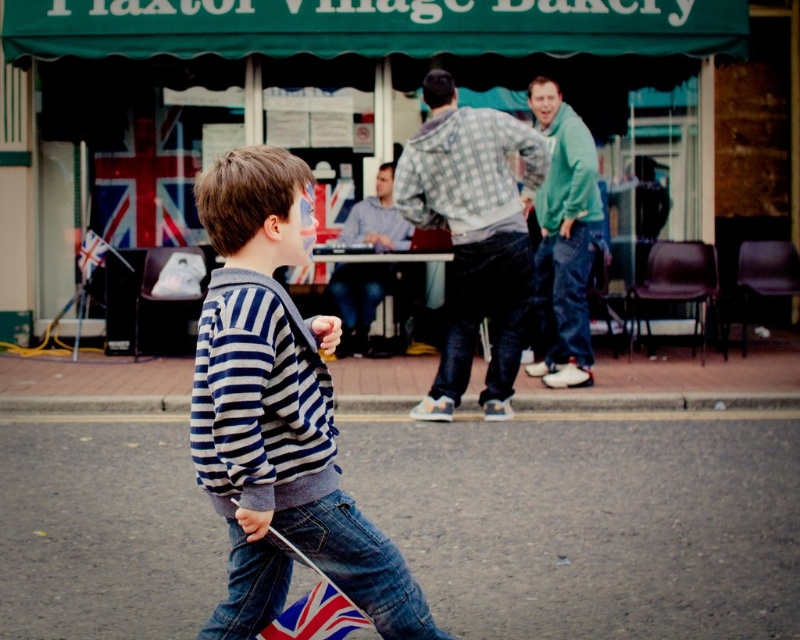
Is checkered fabric shirt at center wider than blue striped shirt at center?

Indeed, checkered fabric shirt at center has a greater width compared to blue striped shirt at center.

Based on the photo, does checkered fabric shirt at center appear on the right side of blue striped shirt at center?

Indeed, checkered fabric shirt at center is positioned on the right side of blue striped shirt at center.

The width and height of the screenshot is (800, 640). I want to click on checkered fabric shirt at center, so click(474, 236).

You are a GUI agent. You are given a task and a screenshot of the screen. Output one action in this format:
    pyautogui.click(x=<x>, y=<y>)
    Task: Click on the checkered fabric shirt at center
    
    Given the screenshot: What is the action you would take?
    pyautogui.click(x=474, y=236)

Is the position of striped sweater at center more distant than that of union jack flag at lower center?

No.

Which is behind, point (285, 492) or point (348, 611)?

Point (348, 611)

You are a GUI agent. You are given a task and a screenshot of the screen. Output one action in this format:
    pyautogui.click(x=<x>, y=<y>)
    Task: Click on the striped sweater at center
    
    Given the screenshot: What is the action you would take?
    pyautogui.click(x=278, y=412)

Does checkered fabric shirt at center have a larger size compared to green fleece jacket at right?

Incorrect, checkered fabric shirt at center is not larger than green fleece jacket at right.

Does checkered fabric shirt at center appear under green fleece jacket at right?

Correct, checkered fabric shirt at center is located below green fleece jacket at right.

Who is more forward, (542, 168) or (564, 257)?

Point (542, 168) is more forward.

You are a GUI agent. You are given a task and a screenshot of the screen. Output one action in this format:
    pyautogui.click(x=<x>, y=<y>)
    Task: Click on the checkered fabric shirt at center
    The height and width of the screenshot is (640, 800).
    Given the screenshot: What is the action you would take?
    pyautogui.click(x=474, y=236)